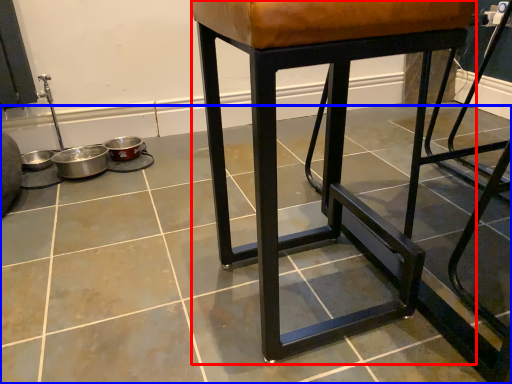
Question: Which object appears farthest to the camera in this image, stool (highlighted by a red box) or concrete (highlighted by a blue box)?

Choices:
 (A) stool
 (B) concrete

Answer: (A)